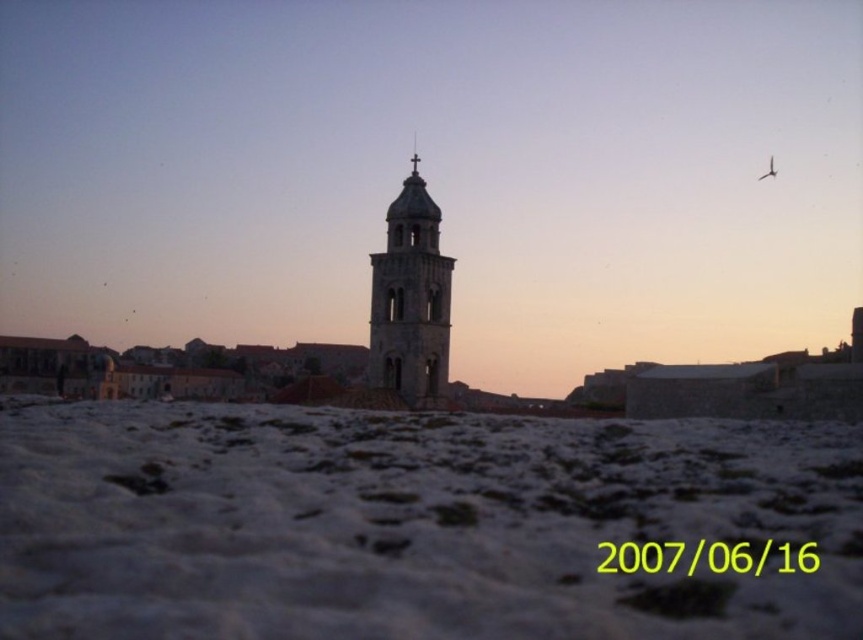
Is white powdery snow at lower center below smooth stone bell tower at center?

Yes, white powdery snow at lower center is below smooth stone bell tower at center.

Between white powdery snow at lower center and smooth stone bell tower at center, which one is positioned lower?

white powdery snow at lower center

Does point (331, 621) come behind point (379, 304)?

That is False.

Identify the location of white powdery snow at lower center. (413, 524).